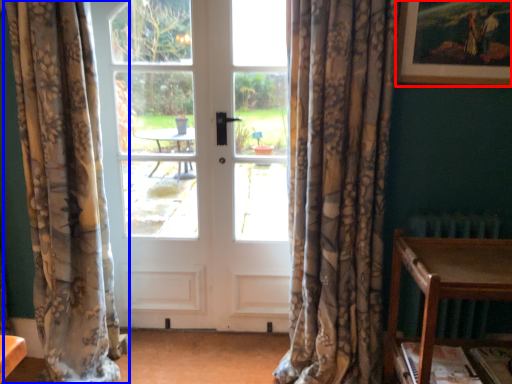
Question: Which object appears closest to the camera in this image, picture frame (highlighted by a red box) or curtain (highlighted by a blue box)?

Choices:
 (A) picture frame
 (B) curtain

Answer: (B)